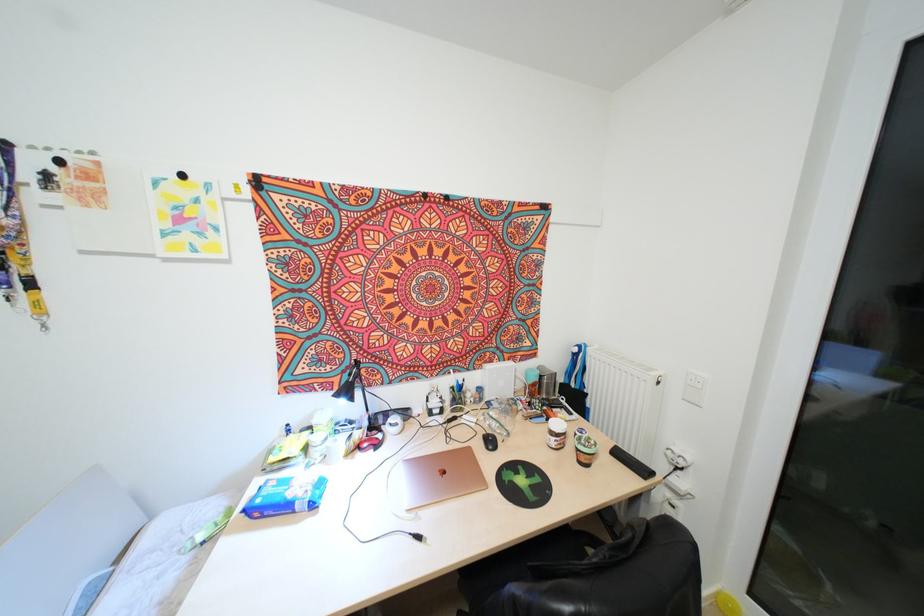
Where would you turn the radiator valve? Please return your answer as a coordinate pair (x, y).

(657, 379)